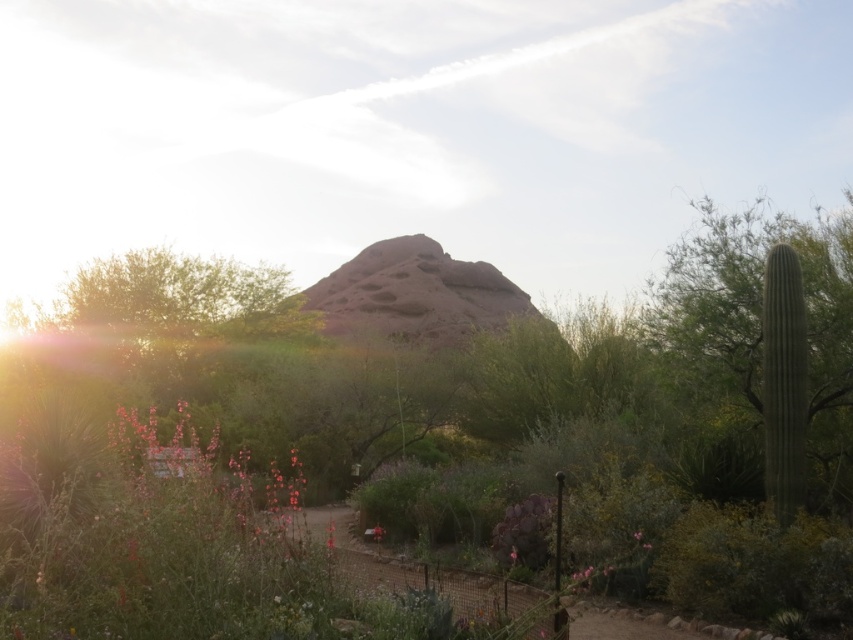
Does rustic rock formation at center appear over green matte flower at center?

Yes, rustic rock formation at center is above green matte flower at center.

Does point (450, 284) come farther from viewer compared to point (373, 536)?

Yes.

Is point (381, 289) positioned behind point (374, 540)?

That is True.

At what (x,y) coordinates should I click in order to perform the action: click on rustic rock formation at center. Please return your answer as a coordinate pair (x, y). This screenshot has height=640, width=853. Looking at the image, I should click on (416, 296).

Where is `green leafy bush at center`? The width and height of the screenshot is (853, 640). green leafy bush at center is located at coordinates (416, 442).

Is the position of green leafy bush at center less distant than that of rustic rock formation at center?

Yes, it is.

The height and width of the screenshot is (640, 853). I want to click on green leafy bush at center, so click(416, 442).

At what (x,y) coordinates should I click in order to perform the action: click on green leafy bush at center. Please return your answer as a coordinate pair (x, y). Looking at the image, I should click on (416, 442).

Can you confirm if green leafy bush at center is positioned below green matte flower at center?

No.

Who is lower down, green leafy bush at center or green matte flower at center?

green matte flower at center

At what (x,y) coordinates should I click in order to perform the action: click on green leafy bush at center. Please return your answer as a coordinate pair (x, y). Looking at the image, I should click on (416, 442).